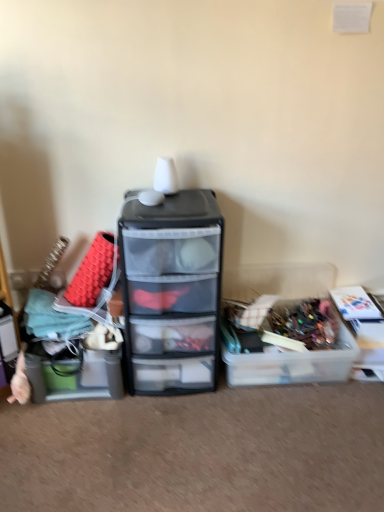
Question: Would you say transparent plastic drawers at center is to the left or to the right of clear plastic storage box at right, which is the 1th storage box in right-to-left order, in the picture?

Choices:
 (A) left
 (B) right

Answer: (A)

Question: Considering the positions of transparent plastic drawers at center and clear plastic storage box at right, which is the 1th storage box in right-to-left order, in the image, is transparent plastic drawers at center wider or thinner than clear plastic storage box at right, which is the 1th storage box in right-to-left order,?

Choices:
 (A) wide
 (B) thin

Answer: (A)

Question: Estimate the real-world distances between objects in this image. Which object is farther from the clear plastic storage box at right, which is the 3th storage box in left-to-right order?

Choices:
 (A) translucent plastic storage box at left, acting as the 1th storage box starting from the left
 (B) translucent plastic container at center-right, which is counted as the second storage box, starting from the right
 (C) transparent plastic drawers at center

Answer: (A)

Question: Based on their relative distances, which object is nearer to the translucent plastic storage box at left, acting as the 1th storage box starting from the left?

Choices:
 (A) translucent plastic container at center-right, acting as the second storage box starting from the left
 (B) clear plastic storage box at right, which is the 1th storage box in right-to-left order
 (C) transparent plastic drawers at center

Answer: (C)